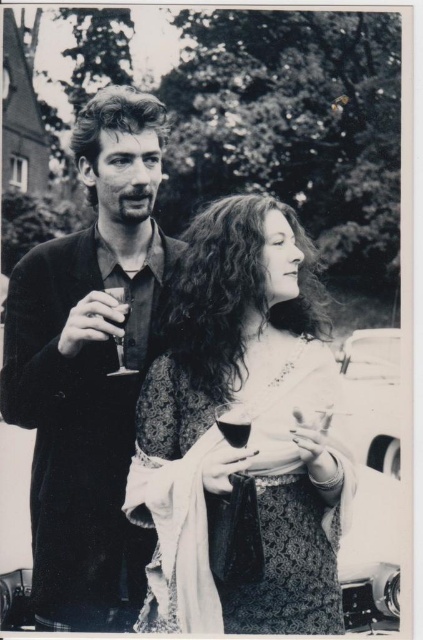
Which is more to the right, translucent glass wine at center or clear glass wine at left?

From the viewer's perspective, translucent glass wine at center appears more on the right side.

Does point (244, 444) come in front of point (115, 314)?

That is True.

The height and width of the screenshot is (640, 423). Identify the location of translucent glass wine at center. (235, 429).

Which is behind, point (95, 134) or point (120, 369)?

Point (95, 134)

Is dark wool coat at left bigger than clear glass wine glass at left?

Indeed, dark wool coat at left has a larger size compared to clear glass wine glass at left.

You are a GUI agent. You are given a task and a screenshot of the screen. Output one action in this format:
    pyautogui.click(x=<x>, y=<y>)
    Task: Click on the dark wool coat at left
    
    Given the screenshot: What is the action you would take?
    pyautogui.click(x=88, y=369)

The height and width of the screenshot is (640, 423). What are the coordinates of `clear glass wine at left` in the screenshot? It's located at (115, 320).

Which is behind, point (117, 312) or point (121, 372)?

The point (121, 372) is behind.

Between point (120, 305) and point (107, 291), which one is positioned behind?

The point (107, 291) is behind.

I want to click on clear glass wine at left, so click(115, 320).